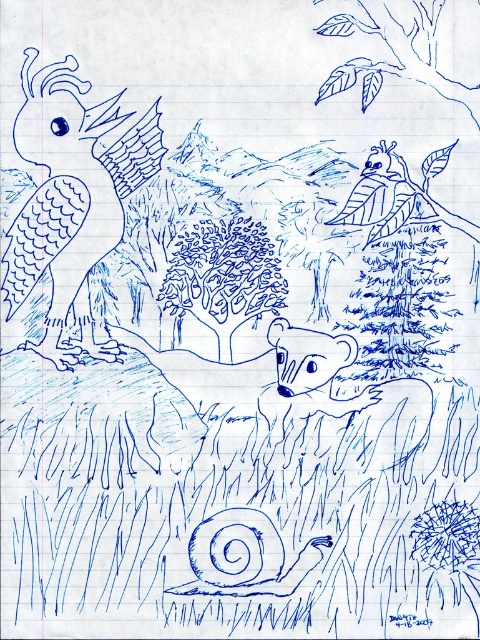
What is the exact position of the blue line art tree at upper center in the image?

The blue line art tree at upper center is located at point (396, 54).

In the whimsical forest scene drawn on lined notebook paper, there is a matte blue bird at upper left and a blue line art tree at upper center. Which of these two objects appears narrower in the drawing?

The matte blue bird at upper left has a lesser width compared to the blue line art tree at upper center, so the matte blue bird at upper left appears narrower in the drawing.

Consider the image. You are an artist looking at the blue ink drawing of the whimsical forest scene. You notice two points marked in the image. The first point is at coordinates point (10, 317) and the second point is at point (356, 61). From your perspective, which point is closer to you?

Point (356, 61) is closer to you because the Objects Description states that point (10, 317) is behind point (356, 61).